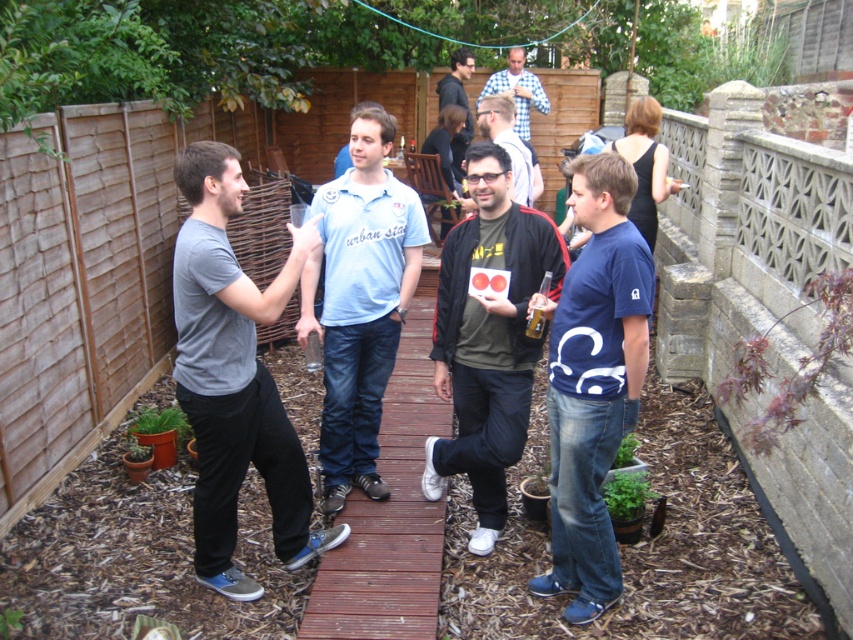
Question: Which of the following is the farthest from the observer?

Choices:
 (A) blue checkered shirt at center
 (B) wooden deck at center
 (C) blue cotton t-shirt at center

Answer: (A)

Question: Which object is positioned closest to the matte black jacket at center?

Choices:
 (A) blue checkered shirt at center
 (B) wooden deck at center
 (C) dark blue shirt at center
 (D) light blue cotton shirt at center

Answer: (D)

Question: Where is matte gray t-shirt at center located in relation to blue checkered shirt at center in the image?

Choices:
 (A) left
 (B) right

Answer: (A)

Question: Is dark green jersey at center positioned behind light blue cotton shirt at center?

Choices:
 (A) no
 (B) yes

Answer: (A)

Question: Does wooden deck at center have a lesser width compared to dark blue shirt at center?

Choices:
 (A) yes
 (B) no

Answer: (B)

Question: Based on their relative distances, which object is nearer to the blue checkered shirt at center?

Choices:
 (A) matte gray t-shirt at center
 (B) blue cotton t-shirt at center
 (C) wooden deck at center

Answer: (C)